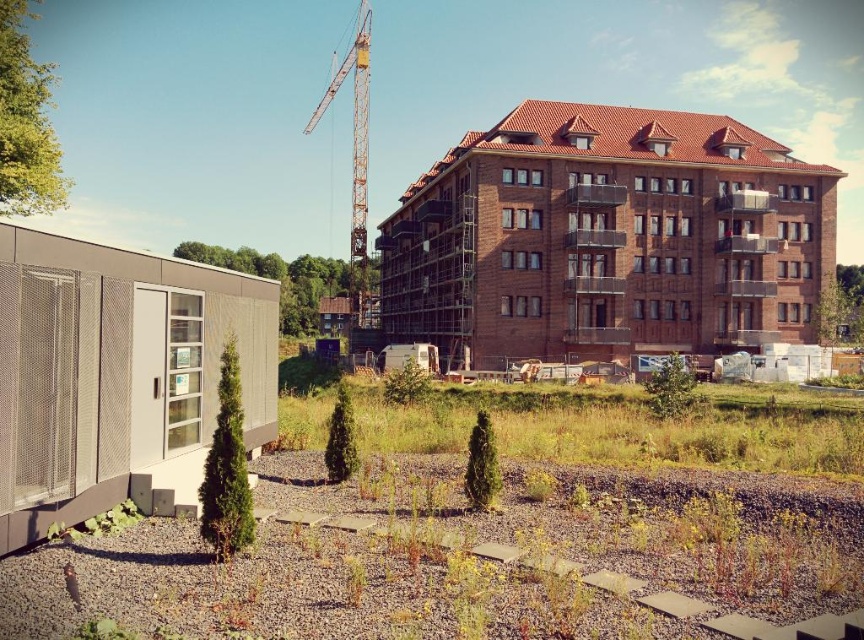
Question: Is brown brick building at center smaller than yellow painted metal crane at upper center?

Choices:
 (A) no
 (B) yes

Answer: (B)

Question: Is brown brick building at center bigger than yellow painted metal crane at upper center?

Choices:
 (A) yes
 (B) no

Answer: (B)

Question: Can you confirm if brown brick building at center is positioned to the left of yellow painted metal crane at upper center?

Choices:
 (A) yes
 (B) no

Answer: (B)

Question: Which of the following is the closest to the observer?

Choices:
 (A) yellow painted metal crane at upper center
 (B) brown brick building at center

Answer: (B)

Question: Which point appears closest to the camera in this image?

Choices:
 (A) (354, 56)
 (B) (639, 307)

Answer: (B)